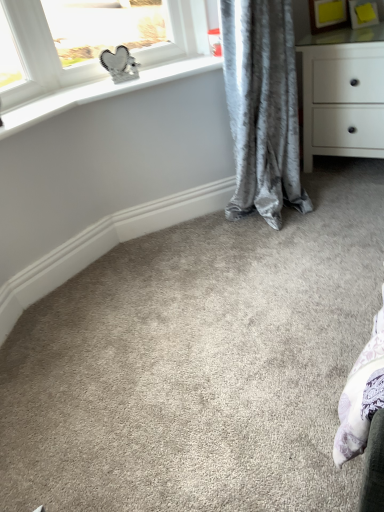
Question: Does point [x=309, y=76] appear closer or farther from the camera than point [x=258, y=159]?

Choices:
 (A) closer
 (B) farther

Answer: (B)

Question: Is white matte chest of drawers at upper right in front of or behind velvet gray curtain at center in the image?

Choices:
 (A) front
 (B) behind

Answer: (B)

Question: From a real-world perspective, is white matte chest of drawers at upper right positioned above or below velvet gray curtain at center?

Choices:
 (A) above
 (B) below

Answer: (B)

Question: Considering the positions of velvet gray curtain at center and white matte chest of drawers at upper right in the image, is velvet gray curtain at center wider or thinner than white matte chest of drawers at upper right?

Choices:
 (A) thin
 (B) wide

Answer: (A)

Question: From the image's perspective, is velvet gray curtain at center positioned above or below white matte chest of drawers at upper right?

Choices:
 (A) above
 (B) below

Answer: (B)

Question: Would you say velvet gray curtain at center is inside or outside white matte chest of drawers at upper right?

Choices:
 (A) inside
 (B) outside

Answer: (B)

Question: From a real-world perspective, is velvet gray curtain at center positioned above or below white matte chest of drawers at upper right?

Choices:
 (A) below
 (B) above

Answer: (B)